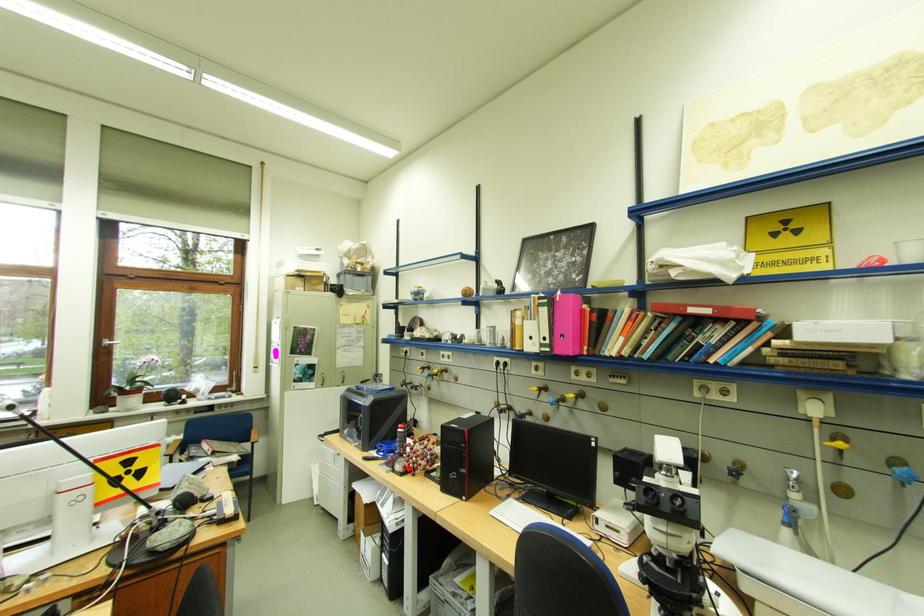
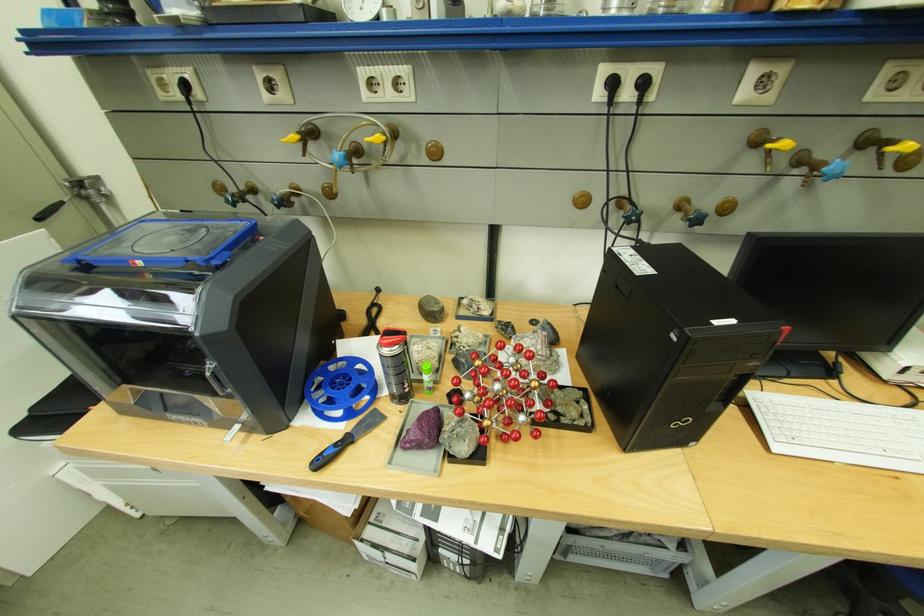
In the second image, find the point that corresponds to the highlighted location in the first image.

(475, 448)